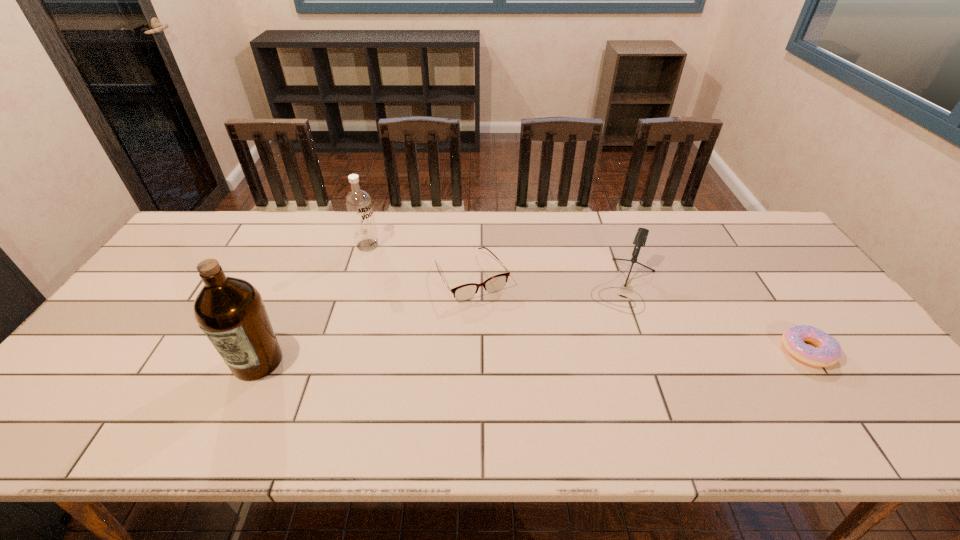
Locate an element on the screen. This screenshot has height=540, width=960. vacant space at the far right corner is located at coordinates (710, 212).

Locate an element on the screen. This screenshot has width=960, height=540. free space between the second object from right to left and the third object from left to right is located at coordinates (548, 281).

Find the location of a particular element. The image size is (960, 540). vacant space that's between the fourth tallest object and the fourth object from right to left is located at coordinates pos(420,261).

Locate an element on the screen. free spot between the second object from left to right and the olive oil is located at coordinates (313, 303).

The width and height of the screenshot is (960, 540). Identify the location of empty location between the third object from right to left and the fourth object from left to right. (548, 281).

Where is `free space that is in between the doughnut and the microphone`? free space that is in between the doughnut and the microphone is located at coordinates (716, 318).

Where is `unoccupied position between the shortest object and the vodka`? unoccupied position between the shortest object and the vodka is located at coordinates (588, 298).

What are the coordinates of `vacant area between the rightmost object and the third shortest object` in the screenshot? It's located at (716, 318).

Identify the location of free spot between the third object from left to right and the olive oil. (365, 320).

Where is `free space between the tallest object and the third tallest object`? The width and height of the screenshot is (960, 540). free space between the tallest object and the third tallest object is located at coordinates (441, 323).